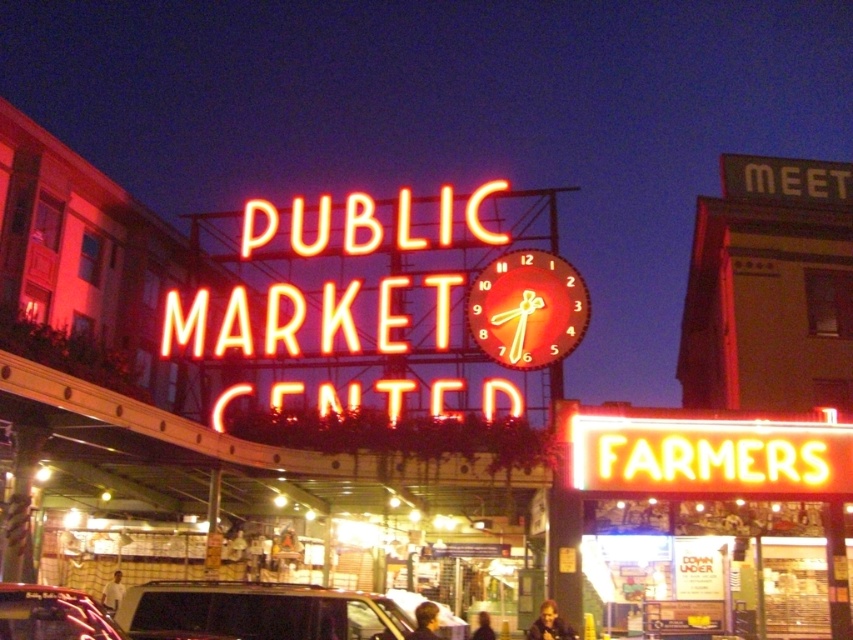
Question: Which of the following is the farthest from the observer?

Choices:
 (A) metallic red car at lower left
 (B) neontexturedsign at center
 (C) neon illuminated clock at center
 (D) dark gray metallic suv at center

Answer: (C)

Question: Considering the real-world distances, which object is farthest from the metallic red car at lower left?

Choices:
 (A) neon illuminated clock at center
 (B) neontexturedsign at center
 (C) dark gray metallic suv at center

Answer: (A)

Question: From the image, what is the correct spatial relationship of dark gray metallic suv at center in relation to neon illuminated clock at center?

Choices:
 (A) below
 (B) above

Answer: (A)

Question: Is neontexturedsign at center wider than metallic red car at lower left?

Choices:
 (A) no
 (B) yes

Answer: (B)

Question: Where is neontexturedsign at center located in relation to dark gray metallic suv at center in the image?

Choices:
 (A) right
 (B) left

Answer: (A)

Question: Which object appears closest to the camera in this image?

Choices:
 (A) neon illuminated clock at center
 (B) dark gray metallic suv at center

Answer: (B)